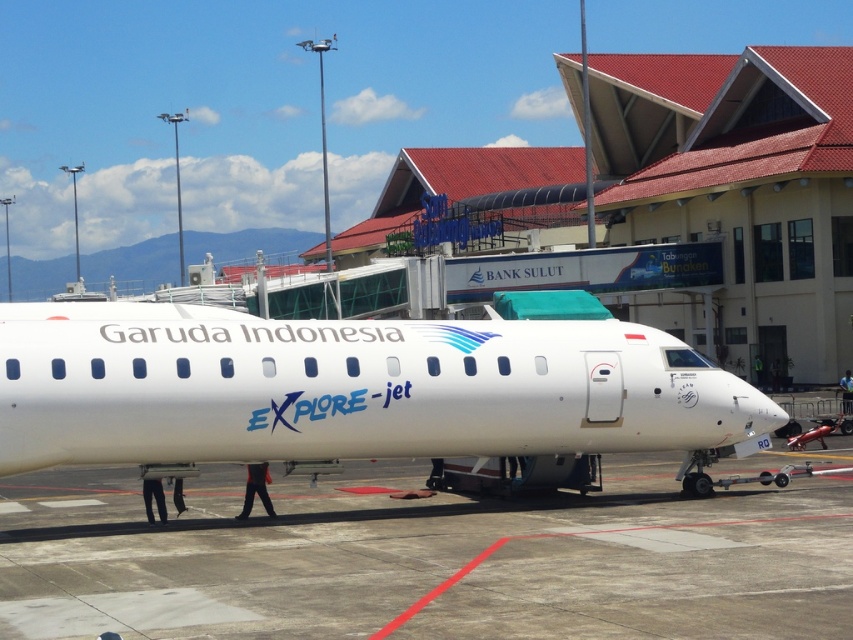
You are a photographer standing at the airport tarmac. You want to take a photo of the white glossy airplane at center and the concrete at center. According to the scene, which object is located to the right of the airplane?

The concrete at center is positioned on the right side of the white glossy airplane at center, so the concrete at center is located to the right of the airplane.

You are a maintenance worker needing to move a 3 meter wide equipment cart from the terminal to the airplane. The path between the terminal and the airplane is the concrete at center. Can you safely move the cart through this path without hitting the white glossy airplane at center?

The concrete at center might be wider than the white glossy airplane at center, so there is a possibility that the 3 meter wide equipment cart can pass safely. However, since the exact width isn not specified, it is recommended to measure the path width before moving the cart to ensure it doesn not collide with the airplane.

You are a maintenance worker who needs to move a 3.5 meter long ladder from the concrete at center to the white glossy airplane at center. Can you move it without tilting it vertically? Explain your reasoning.

The distance between the concrete at center and the white glossy airplane at center is 2.75 meters. Since the ladder is 3.5 meters long, which is longer than the available space, you cannot move it horizontally without tilting it vertically.